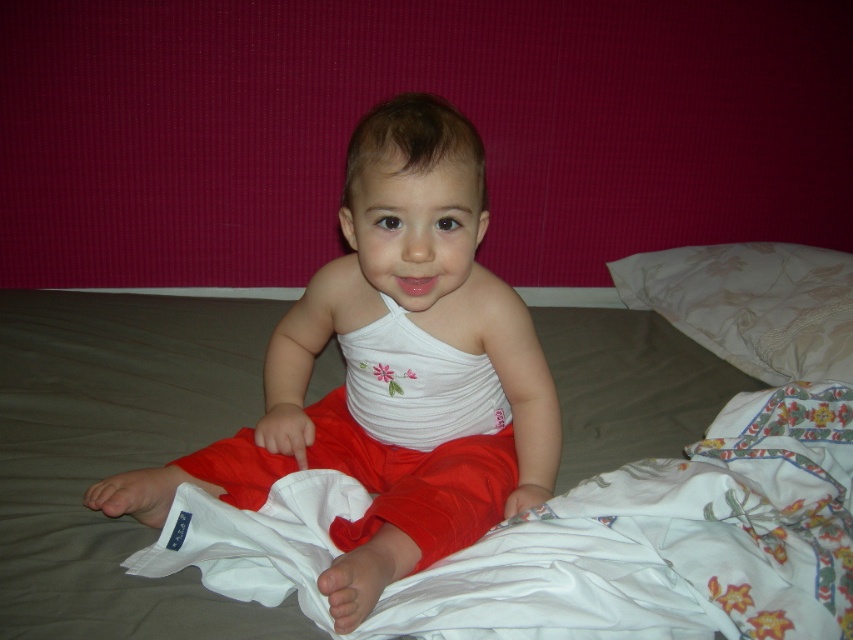
Question: Which of the following is the farthest from the observer?

Choices:
 (A) (735, 282)
 (B) (730, 372)

Answer: (A)

Question: Which point is farther from the camera taking this photo?

Choices:
 (A) (601, 326)
 (B) (807, 376)
 (C) (358, 204)

Answer: (A)

Question: Can you confirm if white fabric bed at center is positioned to the right of white textured pillow at upper right?

Choices:
 (A) yes
 (B) no

Answer: (B)

Question: Which is farther from the white soft fabric at center?

Choices:
 (A) white textured pillow at upper right
 (B) white fabric bed at center

Answer: (A)

Question: Is white fabric bed at center thinner than white textured pillow at upper right?

Choices:
 (A) yes
 (B) no

Answer: (B)

Question: Observing the image, what is the correct spatial positioning of white soft fabric at center in reference to white textured pillow at upper right?

Choices:
 (A) right
 (B) left

Answer: (B)